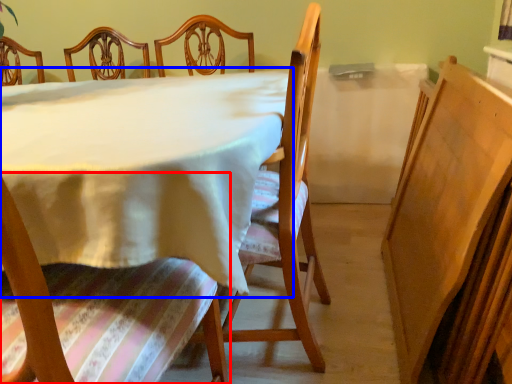
Question: Which point is further to the camera, chair (highlighted by a red box) or table (highlighted by a blue box)?

Choices:
 (A) chair
 (B) table

Answer: (B)